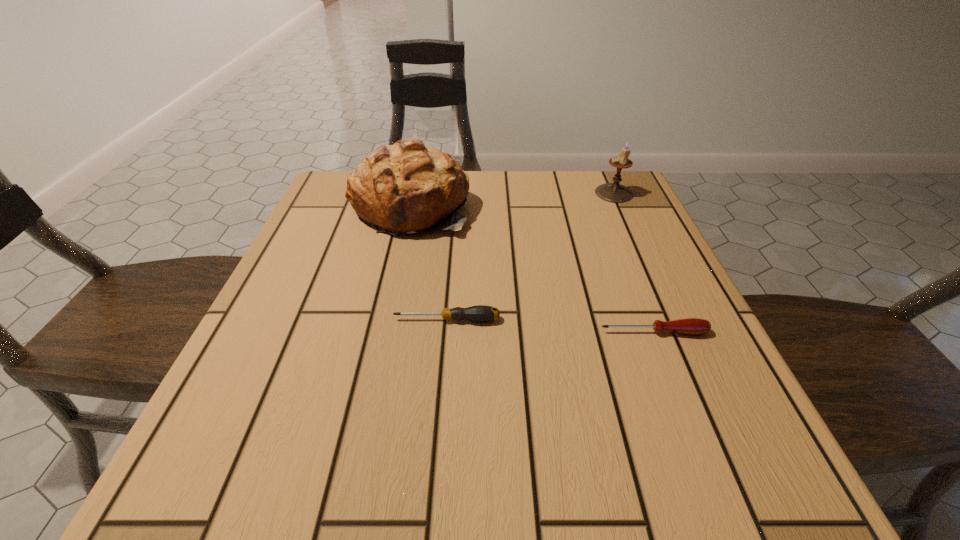
Locate an element on the screen. The height and width of the screenshot is (540, 960). vacant space at the right edge is located at coordinates (635, 265).

This screenshot has height=540, width=960. In order to click on free space at the near right corner of the desktop in this screenshot , I will do `click(713, 463)`.

Identify the location of vacant point located between the right screwdriver and the candle holder. Image resolution: width=960 pixels, height=540 pixels. (634, 262).

Locate an element on the screen. free space between the bread and the candle holder is located at coordinates (513, 200).

The image size is (960, 540). Find the location of `vacant space that is in between the farther screwdriver and the nearest object`. vacant space that is in between the farther screwdriver and the nearest object is located at coordinates (550, 326).

This screenshot has width=960, height=540. In order to click on empty space between the bread and the candle holder in this screenshot , I will do `click(513, 200)`.

Find the location of a particular element. This screenshot has width=960, height=540. empty space that is in between the bread and the left screwdriver is located at coordinates (429, 263).

Identify the location of free spot between the second nearest object and the nearest object. (550, 326).

This screenshot has height=540, width=960. Identify the location of free space between the bread and the right screwdriver. (532, 269).

Find the location of a particular element. The width and height of the screenshot is (960, 540). unoccupied position between the left screwdriver and the bread is located at coordinates (429, 263).